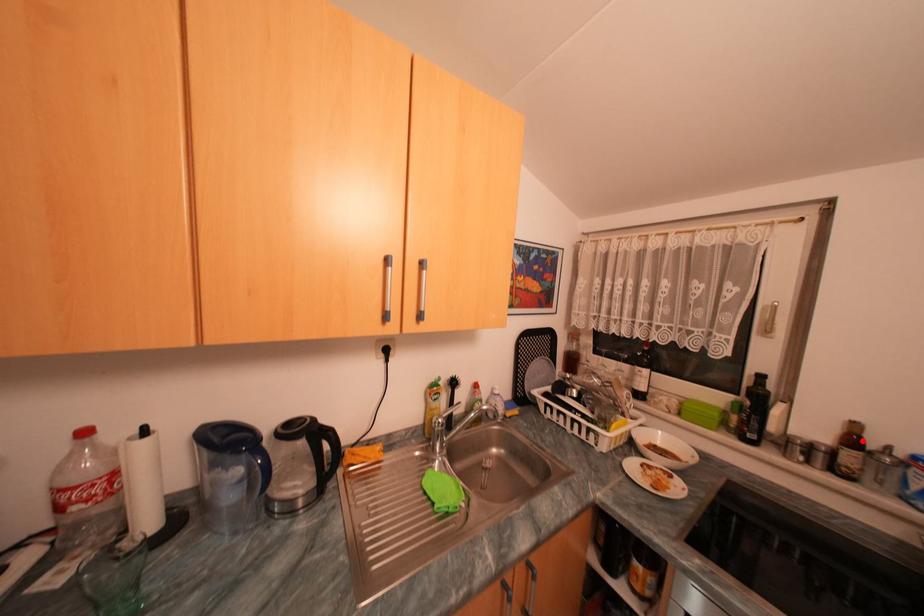
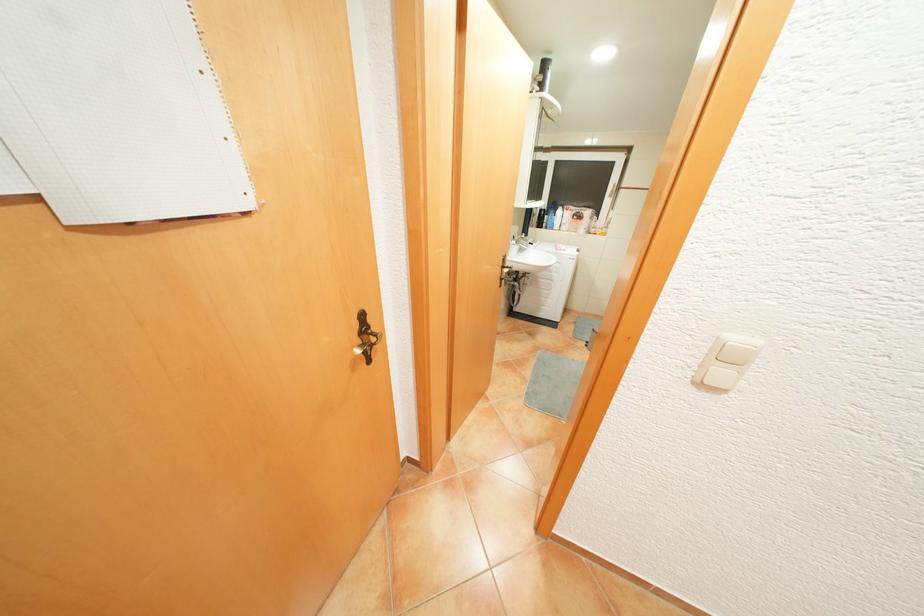
Question: I am providing you with two images of the same scene from different viewpoints. A red point is marked on the first image. Can you still see the location of the red point in image 2?

Choices:
 (A) Yes
 (B) No

Answer: (B)